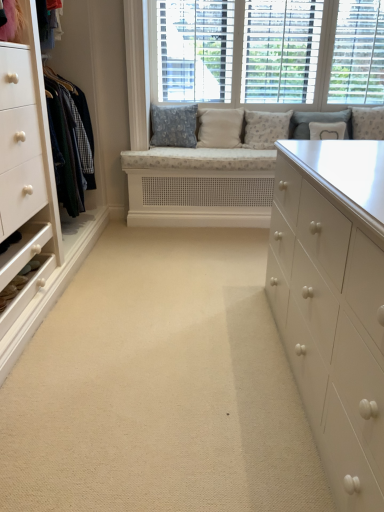
Question: Considering the positions of white fabric pillow at upper center, which ranks as the second pillow in right-to-left order, and textured blue pillow at center, the first pillow positioned from the left, in the image, is white fabric pillow at upper center, which ranks as the second pillow in right-to-left order, wider or thinner than textured blue pillow at center, the first pillow positioned from the left,?

Choices:
 (A) thin
 (B) wide

Answer: (A)

Question: Is white fabric pillow at upper center, which ranks as the second pillow in right-to-left order, in front of or behind textured blue pillow at center, which ranks as the 6th pillow in right-to-left order, in the image?

Choices:
 (A) behind
 (B) front

Answer: (B)

Question: Which object is positioned farthest from the beige fabric pillow at center, which is counted as the fifth pillow, starting from the right?

Choices:
 (A) textured blue pillow at center, which ranks as the 6th pillow in right-to-left order
 (B) white fabric pillow at upper center, which ranks as the second pillow in right-to-left order
 (C) patterned fabric pillow at center, which is the third pillow in left-to-right order
 (D) beige carpet at center
 (E) fluffy white pillow at upper right, the 1th pillow from the right

Answer: (D)

Question: Based on their relative distances, which object is farther from the white textured pillow at upper center, the fourth pillow positioned from the left?

Choices:
 (A) white fabric pillow at upper center, the 5th pillow in the left-to-right sequence
 (B) beige fabric pillow at center, which ranks as the second pillow in left-to-right order
 (C) patterned fabric pillow at center, the 4th pillow in the right-to-left sequence
 (D) beige carpet at center
 (E) textured blue pillow at center, the first pillow positioned from the left

Answer: (D)